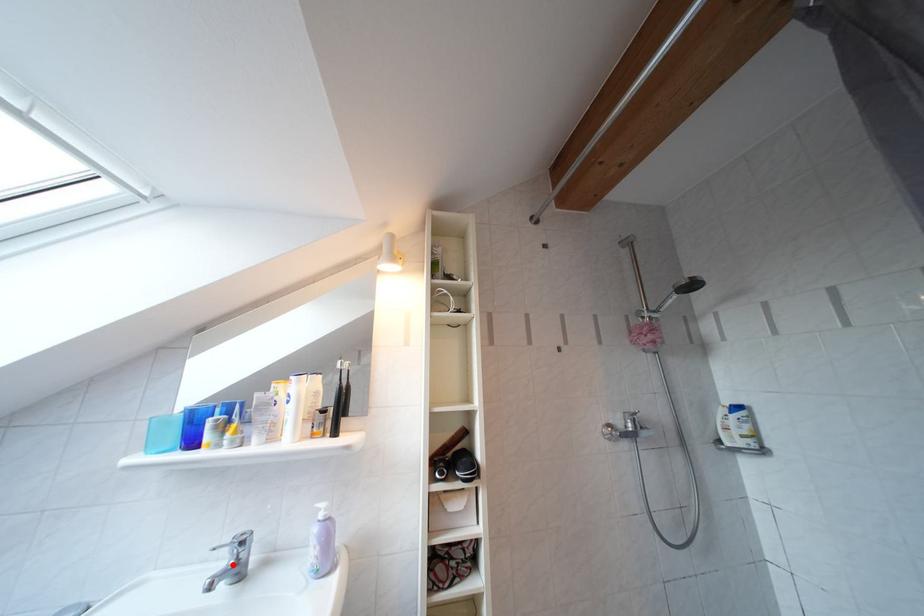
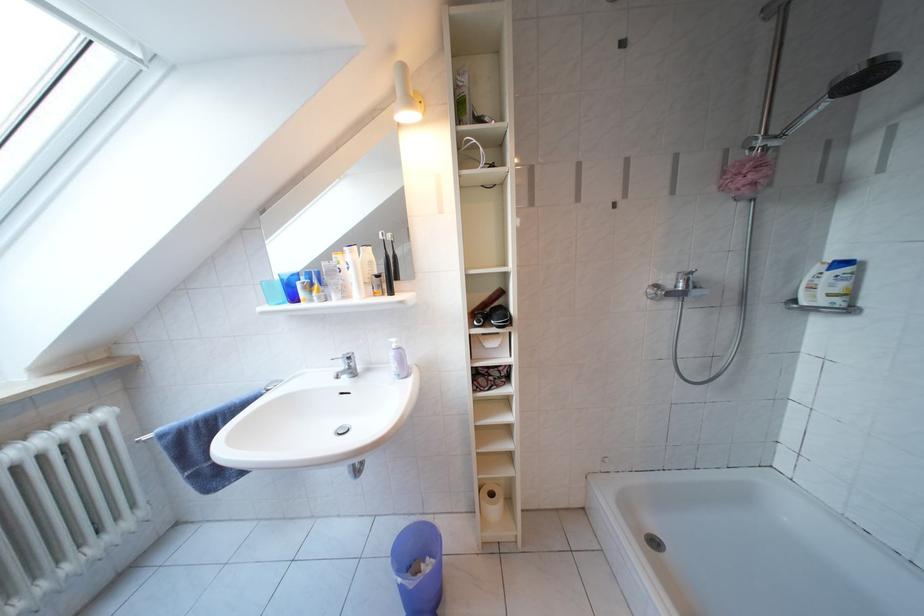
Find the pixel in the second image that matches the highlighted location in the first image.

(349, 371)